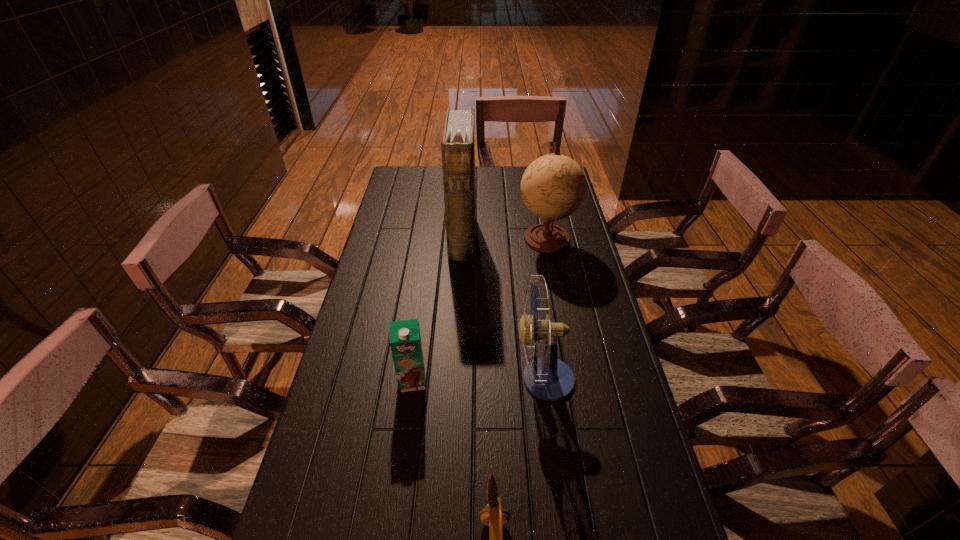
Locate an element on the screen. This screenshot has height=540, width=960. phonebook is located at coordinates (458, 141).

Locate an element on the screen. the tallest object is located at coordinates (458, 141).

Locate an element on the screen. This screenshot has width=960, height=540. globe is located at coordinates (553, 187).

Find the location of a particular element. fan is located at coordinates (548, 378).

This screenshot has height=540, width=960. In order to click on carton in this screenshot , I will do `click(405, 341)`.

What are the coordinates of `free space located on the cover of the tallest object` in the screenshot? It's located at (517, 238).

This screenshot has width=960, height=540. I want to click on free space located on the surface of the globe, so click(560, 308).

The width and height of the screenshot is (960, 540). In order to click on free space located 0.240m at the front of the fan where the blades are visible in this screenshot , I will do `click(427, 379)`.

This screenshot has width=960, height=540. Find the location of `vacant space located at the front of the fan where the blades are visible`. vacant space located at the front of the fan where the blades are visible is located at coordinates (445, 379).

Identify the location of free space located at the front of the fan where the blades are visible. The image size is (960, 540). (445, 379).